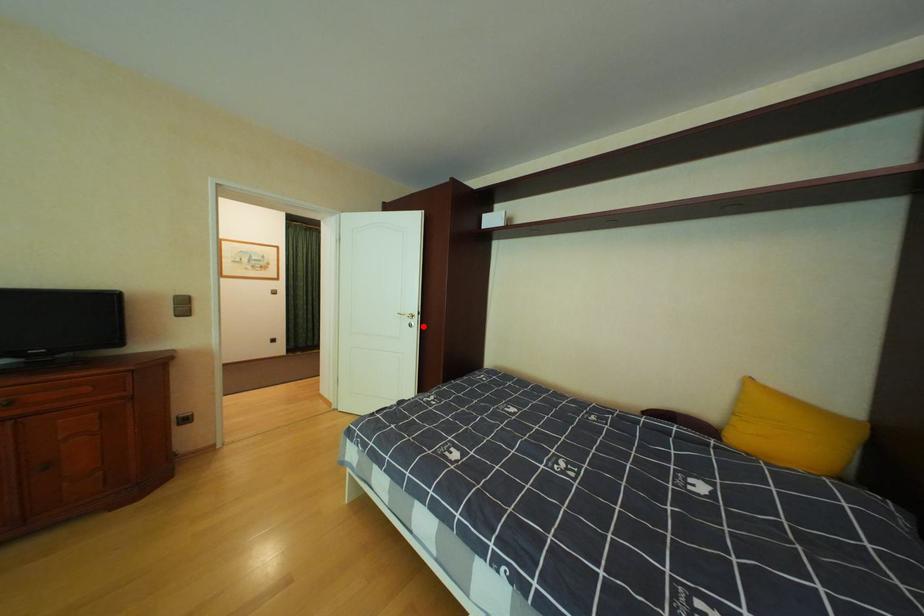
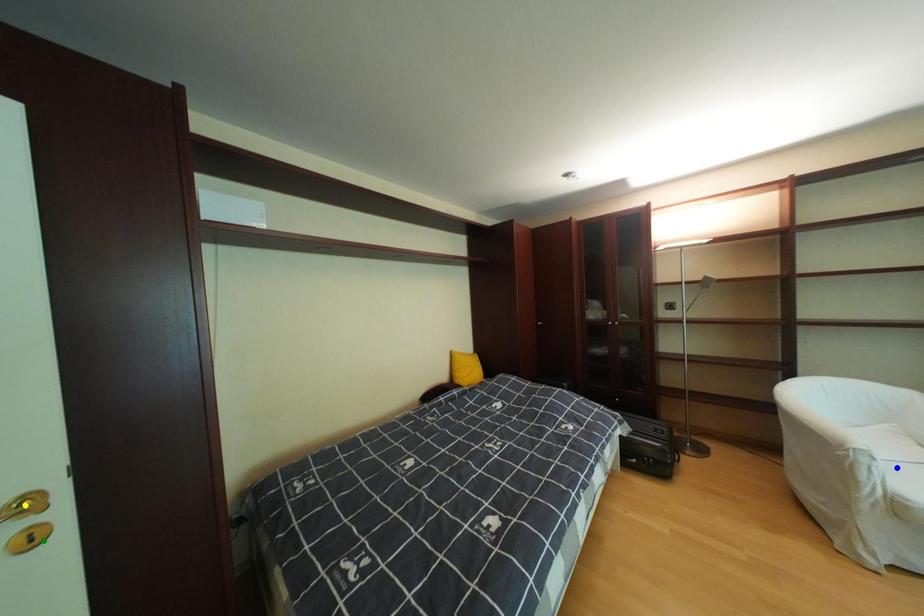
Question: I am providing you with two images of the same scene from different viewpoints. A red point is marked on the first image. You are given multiple points on the second image. Which mark in image 2 goes with the point in image 1?

Choices:
 (A) green point
 (B) blue point
 (C) yellow point

Answer: (A)